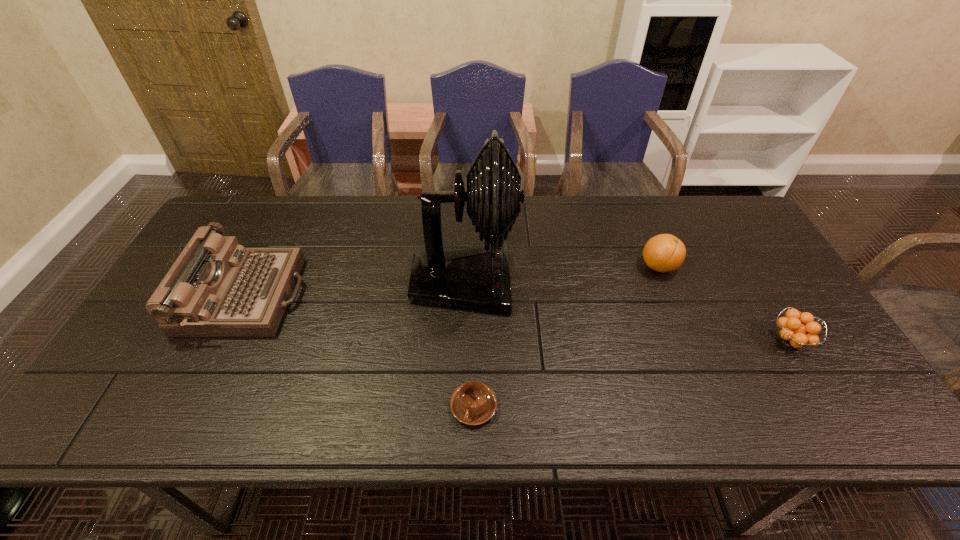
You are a GUI agent. You are given a task and a screenshot of the screen. Output one action in this format:
    pyautogui.click(x=<x>, y=<y>)
    Task: Click on the fan
    This screenshot has height=540, width=960.
    Given the screenshot: What is the action you would take?
    pyautogui.click(x=477, y=278)

Find the location of a particular element. the leftmost object is located at coordinates (x=216, y=288).

Identify the location of the fourth shortest object. (216, 288).

Locate an element on the screen. This screenshot has height=540, width=960. the farther orange fruit is located at coordinates (663, 253).

Identify the location of the third tallest object. (663, 253).

Locate an element on the screen. the fourth tallest object is located at coordinates (793, 333).

Where is `the nearer orange fruit`? the nearer orange fruit is located at coordinates (793, 333).

Locate an element on the screen. the shortest object is located at coordinates (473, 403).

At what (x,y) coordinates should I click in order to perform the action: click on cappuccino. Please return your answer as a coordinate pair (x, y). This screenshot has width=960, height=540. Looking at the image, I should click on (473, 403).

You are a GUI agent. You are given a task and a screenshot of the screen. Output one action in this format:
    pyautogui.click(x=<x>, y=<y>)
    Task: Click on the vacant space located 0.120m in front of the tallest object to blow air
    The image size is (960, 540).
    Given the screenshot: What is the action you would take?
    pyautogui.click(x=560, y=283)